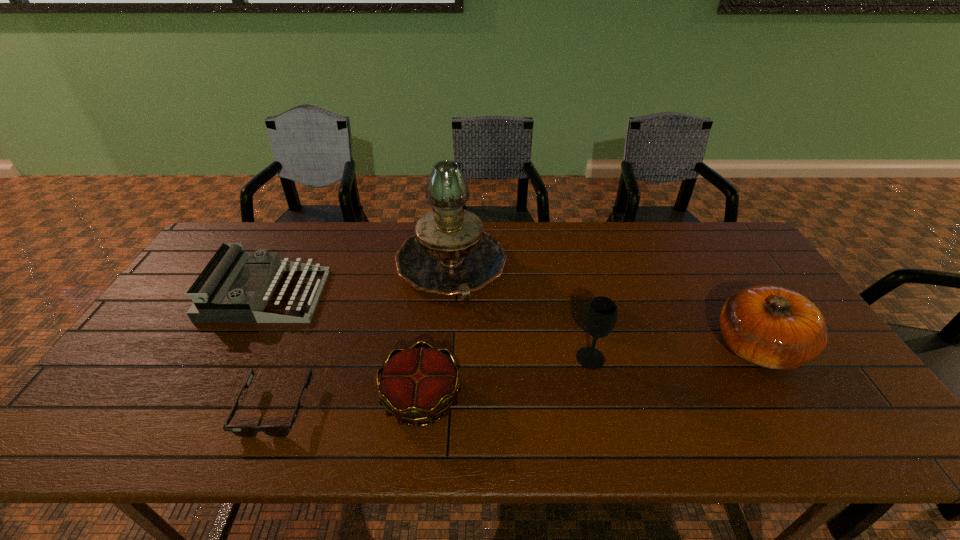
You are a GUI agent. You are given a task and a screenshot of the screen. Output one action in this format:
    pyautogui.click(x=<x>, y=<y>)
    Task: Click on the vacant point located between the typewriter and the wineglass
    Image resolution: width=960 pixels, height=540 pixels.
    Given the screenshot: What is the action you would take?
    pyautogui.click(x=428, y=327)

At what (x,y) coordinates should I click in order to perform the action: click on unoccupied area between the wineglass and the oil lamp. Please return your answer as a coordinate pair (x, y). Looking at the image, I should click on (520, 312).

Identify the location of vacant point located between the tallest object and the sunglasses. This screenshot has width=960, height=540. (363, 337).

I want to click on empty space between the typewriter and the tallest object, so click(x=358, y=281).

Find the location of `empty location between the sunglasses and the oil lamp`. empty location between the sunglasses and the oil lamp is located at coordinates (363, 337).

Image resolution: width=960 pixels, height=540 pixels. Find the location of `free area in between the typewriter and the crown`. free area in between the typewriter and the crown is located at coordinates (344, 347).

Where is `vacant space in between the sunglasses and the crown`? vacant space in between the sunglasses and the crown is located at coordinates (348, 403).

Identify which object is located as the nearest to the rightmost object. Please provide its 2D coordinates. Your answer should be formatted as a tuple, i.e. [(x, y)], where the tuple contains the x and y coordinates of a point satisfying the conditions above.

[(600, 317)]

Identify which object is the second nearest to the typewriter. Please provide its 2D coordinates. Your answer should be formatted as a tuple, i.e. [(x, y)], where the tuple contains the x and y coordinates of a point satisfying the conditions above.

[(450, 254)]

At what (x,y) coordinates should I click in order to perform the action: click on free space in the image that satisfies the following two spatial constraints: 1. on the back side of the crown; 2. on the right side of the pumpkin. Please return your answer as a coordinate pair (x, y). Looking at the image, I should click on (427, 347).